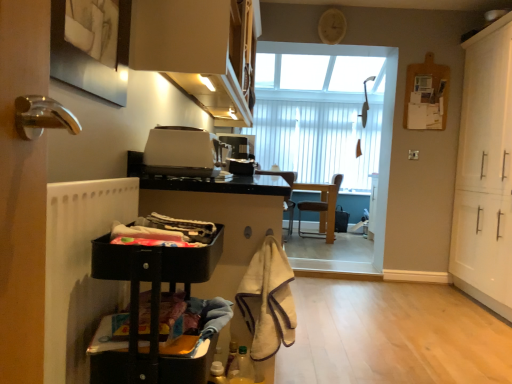
Question: Is satin black toaster at center, acting as the first appliance starting from the back, bigger or smaller than matte black laundry basket at lower left, arranged as the 2th laundry when ordered from the bottom?

Choices:
 (A) small
 (B) big

Answer: (A)

Question: From the image's perspective, relative to matte black laundry basket at lower left, the 1th laundry in the top-to-bottom sequence, is satin black toaster at center, acting as the first appliance starting from the back, above or below?

Choices:
 (A) above
 (B) below

Answer: (A)

Question: Based on their relative distances, which object is nearer to the black plastic cart at lower left, positioned as the first cabinetry in left-to-right order?

Choices:
 (A) brown leather chair at center, positioned as the 1th chair in right-to-left order
 (B) matte white cabinet at upper center, the 2th cabinetry positioned from the left
 (C) white matte cabinet at right, the third cabinetry from the left
 (D) brown leather chair at center, placed as the 1th chair when sorted from left to right
 (E) beige fuzzy towel at lower center

Answer: (E)

Question: Which of these objects is positioned closest to the brown leather chair at center, placed as the 1th chair when sorted from left to right?

Choices:
 (A) white matte radiator at left
 (B) white matte cabinet at right, which ranks as the 1th cabinetry in right-to-left order
 (C) satin black toaster at center, acting as the first appliance starting from the back
 (D) matte black laundry basket at lower left, the 1th laundry in the top-to-bottom sequence
 (E) black plastic cart at lower left, arranged as the third cabinetry when viewed from the right

Answer: (B)